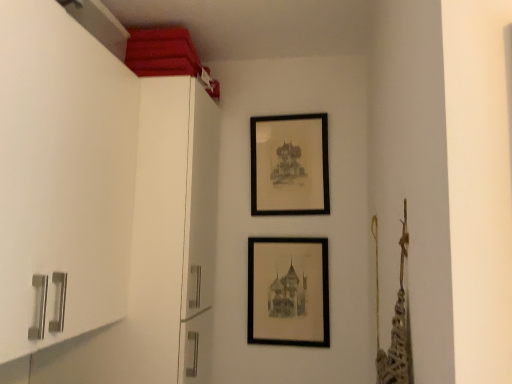
Question: In the image, is matte black picture frame at center, positioned as the 2th picture frame in top-to-bottom order, positioned in front of or behind black matte picture frame at upper center, which is counted as the 1th picture frame, starting from the top?

Choices:
 (A) front
 (B) behind

Answer: (A)

Question: Considering the positions of matte black picture frame at center, positioned as the 2th picture frame in top-to-bottom order, and black matte picture frame at upper center, which is the 2th picture frame in bottom-to-top order, in the image, is matte black picture frame at center, positioned as the 2th picture frame in top-to-bottom order, bigger or smaller than black matte picture frame at upper center, which is the 2th picture frame in bottom-to-top order,?

Choices:
 (A) big
 (B) small

Answer: (B)

Question: From a real-world perspective, is matte black picture frame at center, arranged as the first picture frame when ordered from the bottom, positioned above or below black matte picture frame at upper center, which is the 2th picture frame in bottom-to-top order?

Choices:
 (A) below
 (B) above

Answer: (A)

Question: Based on their positions, is black matte picture frame at upper center, which is counted as the 1th picture frame, starting from the top, located to the left or right of matte black picture frame at center, arranged as the first picture frame when ordered from the bottom?

Choices:
 (A) right
 (B) left

Answer: (A)

Question: Looking at their shapes, would you say black matte picture frame at upper center, which is the 2th picture frame in bottom-to-top order, is wider or thinner than matte black picture frame at center, positioned as the 2th picture frame in top-to-bottom order?

Choices:
 (A) thin
 (B) wide

Answer: (B)

Question: Is point (302, 165) positioned closer to the camera than point (266, 337)?

Choices:
 (A) closer
 (B) farther

Answer: (B)

Question: Is black matte picture frame at upper center, which is the 2th picture frame in bottom-to-top order, taller or shorter than matte black picture frame at center, positioned as the 2th picture frame in top-to-bottom order?

Choices:
 (A) short
 (B) tall

Answer: (B)